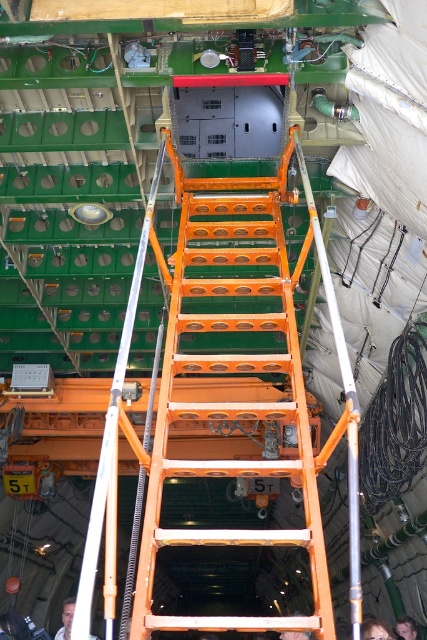
You are a maintenance worker needing to reach the ceiling cutouts for inspection. The orange metallic ladder at center is 10 feet tall. Can you safely reach the ceiling cutouts?

The orange metallic ladder at center is 10 feet tall, but the ceiling cutouts are 20.51 feet away from it. Since the ladder is only 10 feet tall, it is not tall enough to reach the ceiling cutouts safely. You need a taller ladder or alternative equipment.

You are a delivery worker who needs to place a package on the orange metallic ladder at center. You are currently standing next to the light skin tone shirt at center. The package is 1 meter in length. Is there enough space between you and the ladder to safely place the package?

The distance between the orange metallic ladder at center and the light skin tone shirt at center is 8.68 meters. Since the package is only 1 meter long, there is more than enough space to safely place it between them.